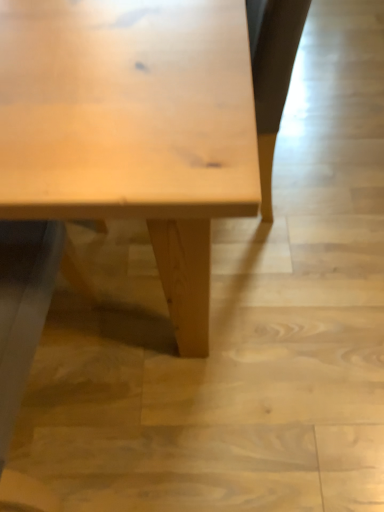
This screenshot has width=384, height=512. What are the coordinates of `matte wood table at center` in the screenshot? It's located at (132, 128).

Measure the distance between point (x=25, y=93) and camera.

Point (x=25, y=93) and camera are 18.46 inches apart from each other.

The height and width of the screenshot is (512, 384). What do you see at coordinates (132, 128) in the screenshot?
I see `matte wood table at center` at bounding box center [132, 128].

What is the approximate height of matte wood table at center?

91.37 centimeters.

Find the location of a particular element. The height and width of the screenshot is (512, 384). matte wood table at center is located at coordinates (132, 128).